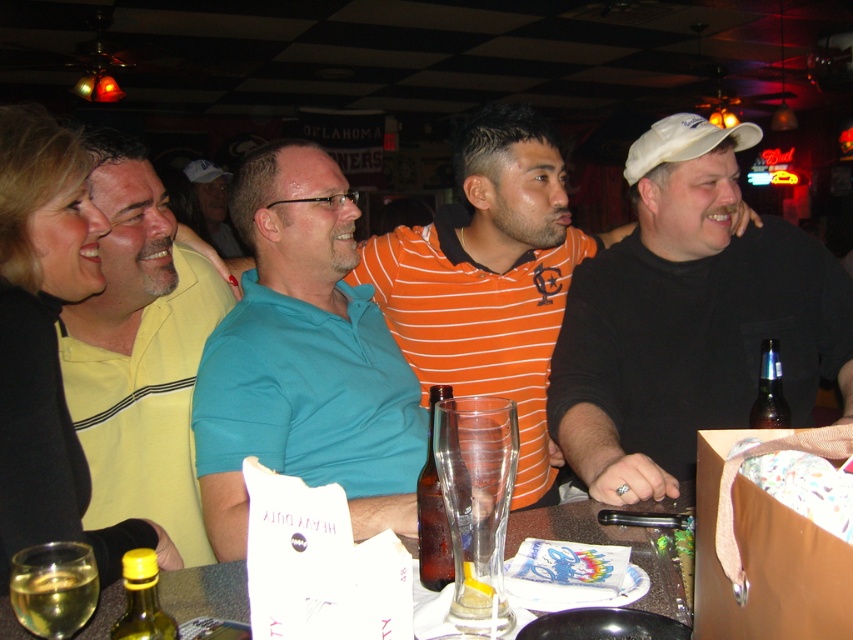
Question: Where is yellow striped polo shirt at left located in relation to matte teal shirt at center in the image?

Choices:
 (A) below
 (B) above

Answer: (A)

Question: Estimate the real-world distances between objects in this image. Which object is farther from the brown glass bottle at center?

Choices:
 (A) yellow striped polo shirt at left
 (B) brown glass bottle at right

Answer: (B)

Question: Which object is positioned closest to the teal polo shirt at center?

Choices:
 (A) brown glass bottle at right
 (B) translucent glass at center

Answer: (B)

Question: Is teal polo shirt at center below brown glass bottle at center?

Choices:
 (A) yes
 (B) no

Answer: (B)

Question: Can you confirm if translucent glass wine at lower left is positioned below brown glass bottle at center?

Choices:
 (A) no
 (B) yes

Answer: (B)

Question: Which is farther from the yellow striped polo shirt at left?

Choices:
 (A) brown glass bottle at center
 (B) translucent glass at center

Answer: (B)